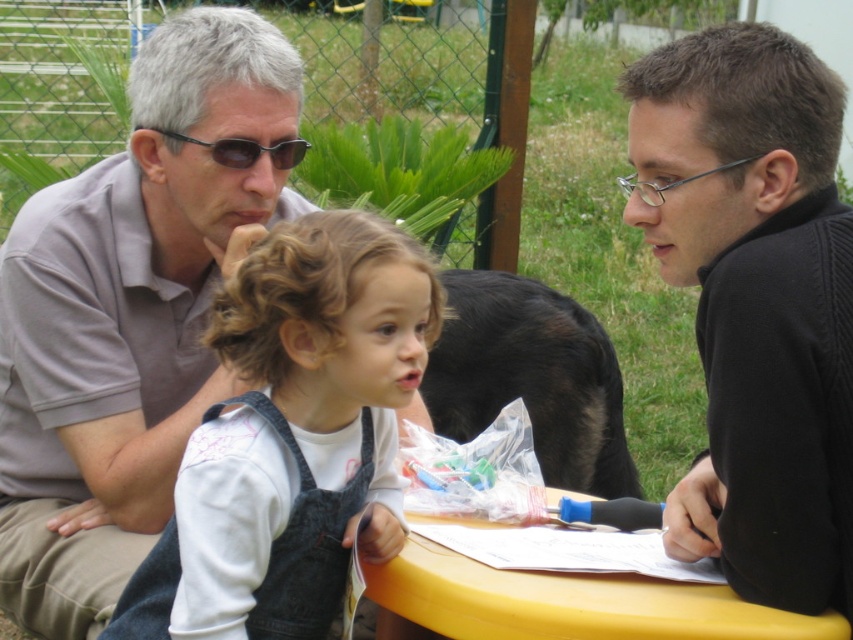
Question: Is black sweater at right positioned at the back of yellow plastic table at lower center?

Choices:
 (A) no
 (B) yes

Answer: (B)

Question: Which point appears closest to the camera in this image?

Choices:
 (A) click(x=195, y=392)
 (B) click(x=398, y=330)

Answer: (B)

Question: Which object is positioned closest to the denim overalls at center?

Choices:
 (A) matte gray shirt at upper left
 (B) black plastic sunglasses at upper center
 (C) yellow plastic table at lower center
 (D) black sweater at right

Answer: (C)

Question: Is matte gray shirt at upper left to the right of yellow plastic table at lower center from the viewer's perspective?

Choices:
 (A) yes
 (B) no

Answer: (B)

Question: Observing the image, what is the correct spatial positioning of matte gray shirt at upper left in reference to denim overalls at center?

Choices:
 (A) left
 (B) right

Answer: (A)

Question: Which of the following is the farthest from the observer?

Choices:
 (A) black plastic sunglasses at upper center
 (B) black sweater at right
 (C) denim overalls at center
 (D) matte gray shirt at upper left

Answer: (A)